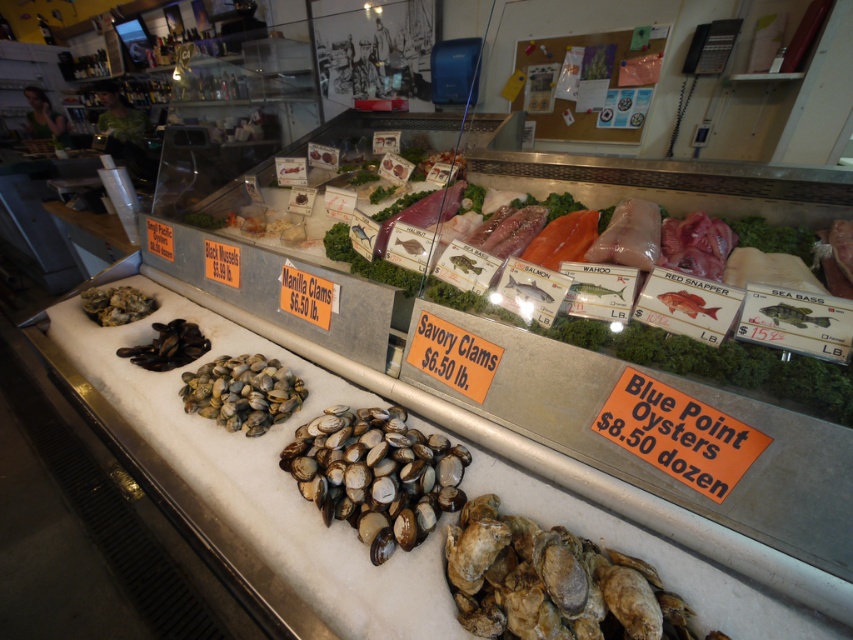
Which of these two, brown matte oyster at lower right or white glossy clam at center, stands shorter?

Standing shorter between the two is brown matte oyster at lower right.

In the scene shown: Does brown matte oyster at lower right appear on the right side of white glossy clam at center?

Correct, you'll find brown matte oyster at lower right to the right of white glossy clam at center.

The width and height of the screenshot is (853, 640). Describe the element at coordinates (550, 582) in the screenshot. I see `brown matte oyster at lower right` at that location.

This screenshot has height=640, width=853. Identify the location of brown matte oyster at lower right. (550, 582).

Is white glossy clam at center above shiny brown shells at left?

Actually, white glossy clam at center is below shiny brown shells at left.

Which is below, white glossy clam at center or shiny brown shells at left?

Positioned lower is white glossy clam at center.

Where is `white glossy clam at center`? Image resolution: width=853 pixels, height=640 pixels. white glossy clam at center is located at coordinates (381, 477).

In order to click on white glossy clam at center in this screenshot , I will do `click(381, 477)`.

Does brown matte oyster at lower right appear on the left side of brown matte clams at center?

No, brown matte oyster at lower right is not to the left of brown matte clams at center.

Between point (451, 529) and point (259, 404), which one is positioned in front?

Point (451, 529) is more forward.

Where is `brown matte oyster at lower right`? brown matte oyster at lower right is located at coordinates (550, 582).